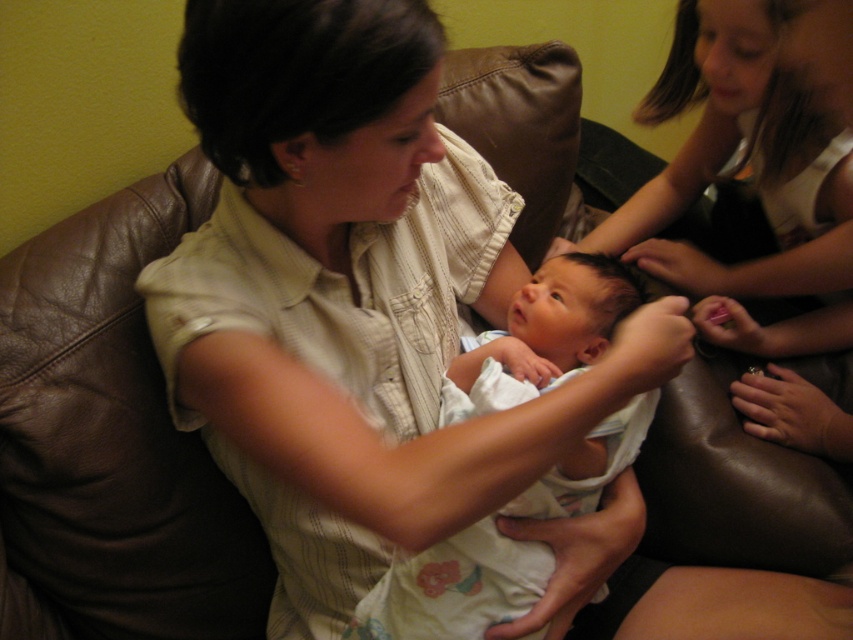
You are a photographer setting up a photo shoot in the living room. You have a camera with a 30 cm wide lens. The scene requires you to capture both the white striped shirt at center and the white cotton baby at center in the same frame. Can the lens accommodate both objects side by side?

The white striped shirt at center is wider than the white cotton baby at center. Since the shirt is wider, the total width required to fit both side by side would exceed the 30 cm lens width. Therefore, the lens cannot accommodate both objects simultaneously.

You are a photographer trying to capture the newborn baby on the brown leather couch. The baby is currently at the point labeled as point (x=352, y=298). To get a clear shot, you need to know where the white striped shirt at center is located relative to the baby. Can you tell me whether the white striped shirt at center is to the left or right of the baby?

The point (x=352, y=298) indicates the location of the white striped shirt at center, so the white striped shirt at center is exactly at the same position as the baby.